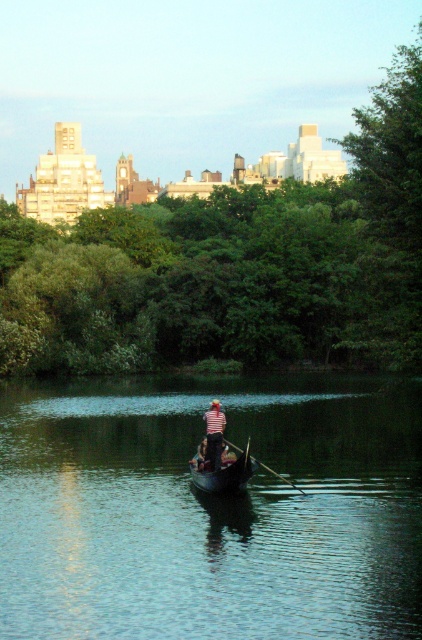
You are a tour guide leading a group on a small boat that is 1.5 meters wide. You need to navigate between the dark brown wooden canoe at center and the striped fabric person at center. Can your boat pass through the gap between them?

The gap between the dark brown wooden canoe at center and the striped fabric person at center is 1.73 meters. Since your boat is 1.5 meters wide, it can safely pass through the gap as the width of the gap is greater than the boat.

You are standing on the dock and see the striped fabric person at center and the wooden polished paddle at center in the gondola. Which object is closer to you?

The striped fabric person at center is closer to you because they are further to the viewer than the wooden polished paddle at center.